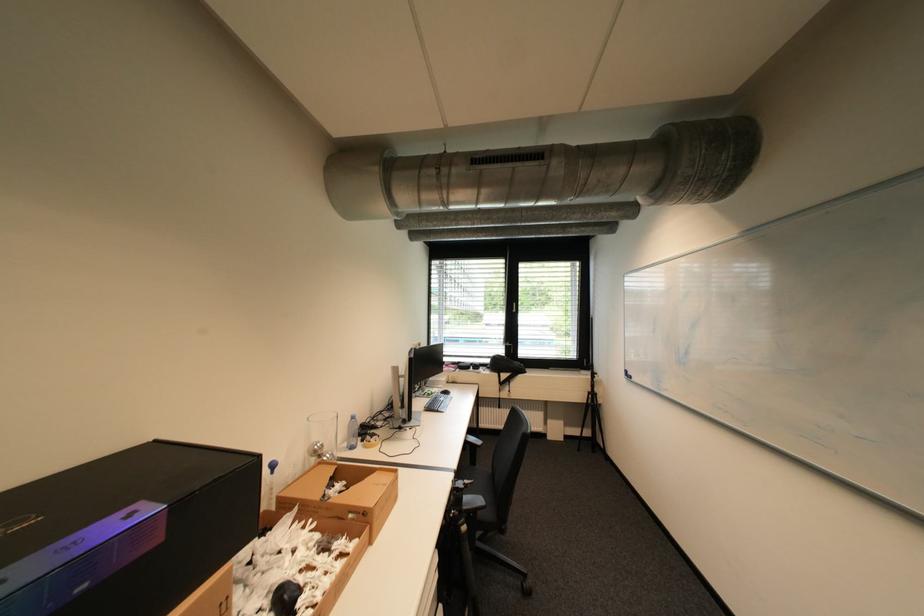
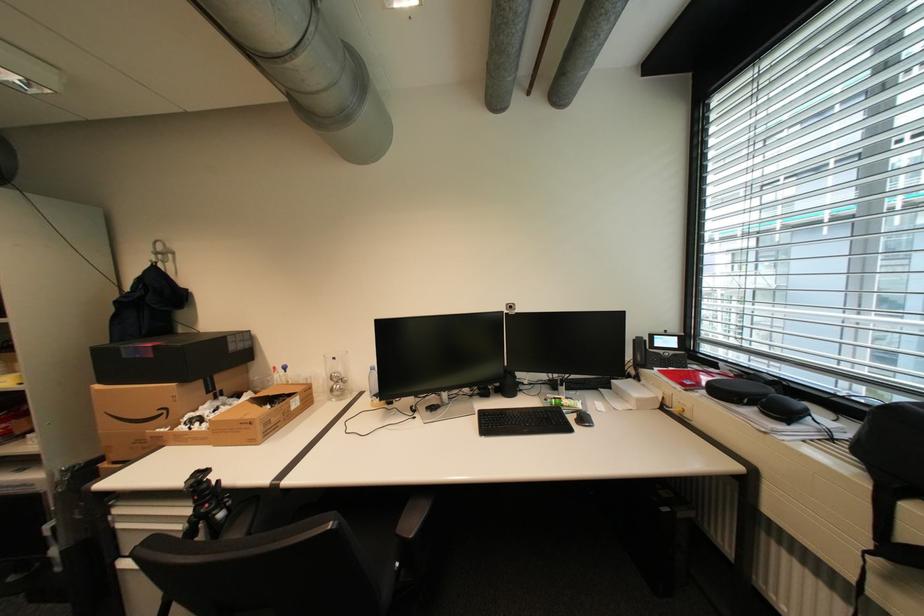
The point at (406, 479) is marked in the first image. Where is the corresponding point in the second image?

(259, 424)